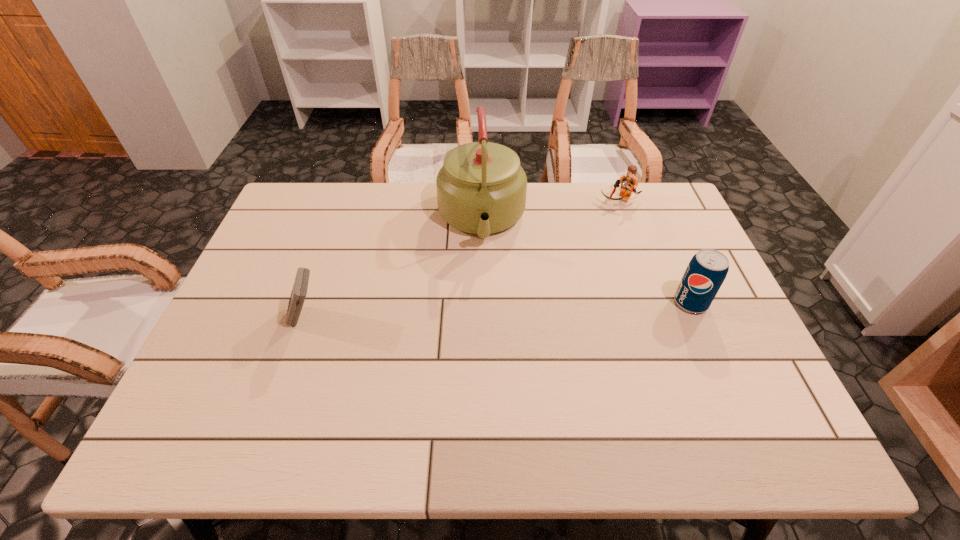
Identify the location of unoccupied area between the leftmost object and the pop. Image resolution: width=960 pixels, height=540 pixels. (498, 310).

Locate an element on the screen. vacant point located between the tallest object and the pop is located at coordinates (587, 261).

Identify the location of free space that is in between the Lego and the leftmost object. Image resolution: width=960 pixels, height=540 pixels. (463, 260).

Where is `empty location between the calculator and the Lego`? empty location between the calculator and the Lego is located at coordinates (463, 260).

Where is `free space between the pop and the kettle`? This screenshot has height=540, width=960. free space between the pop and the kettle is located at coordinates (587, 261).

Identify the location of free spot between the second object from left to right and the calculator. The height and width of the screenshot is (540, 960). (394, 269).

Find the location of a particular element. empty location between the calculator and the pop is located at coordinates (498, 310).

Locate an element on the screen. The image size is (960, 540). free space between the pop and the shortest object is located at coordinates (655, 252).

Where is `object that can be found as the third closest to the kettle`? object that can be found as the third closest to the kettle is located at coordinates [x=707, y=270].

Identify which object is the closest to the pop. Please provide its 2D coordinates. Your answer should be formatted as a tuple, i.e. [(x, y)], where the tuple contains the x and y coordinates of a point satisfying the conditions above.

[(629, 182)]